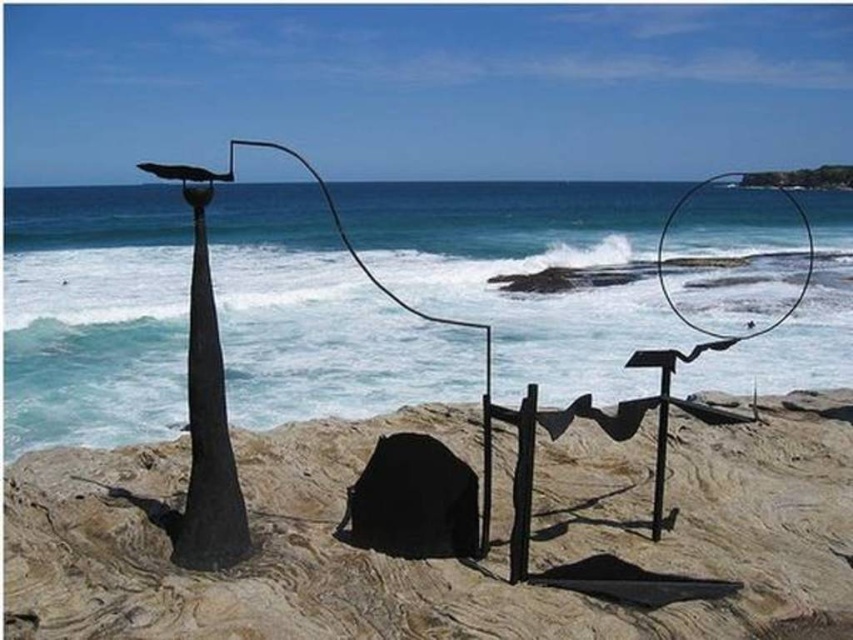
Question: Can you confirm if smooth sand at center is positioned below black matte pole at left?

Choices:
 (A) no
 (B) yes

Answer: (B)

Question: Can you confirm if smooth sand at center is smaller than black matte pole at left?

Choices:
 (A) no
 (B) yes

Answer: (A)

Question: Which object is closer to the camera taking this photo?

Choices:
 (A) smooth sand at center
 (B) black matte pole at left

Answer: (A)

Question: Is smooth sand at center to the right of black matte pole at left from the viewer's perspective?

Choices:
 (A) no
 (B) yes

Answer: (B)

Question: Which of the following is the closest to the observer?

Choices:
 (A) black matte pole at left
 (B) smooth sand at center

Answer: (B)

Question: Which of the following is the closest to the observer?

Choices:
 (A) black matte pole at left
 (B) smooth sand at center

Answer: (B)